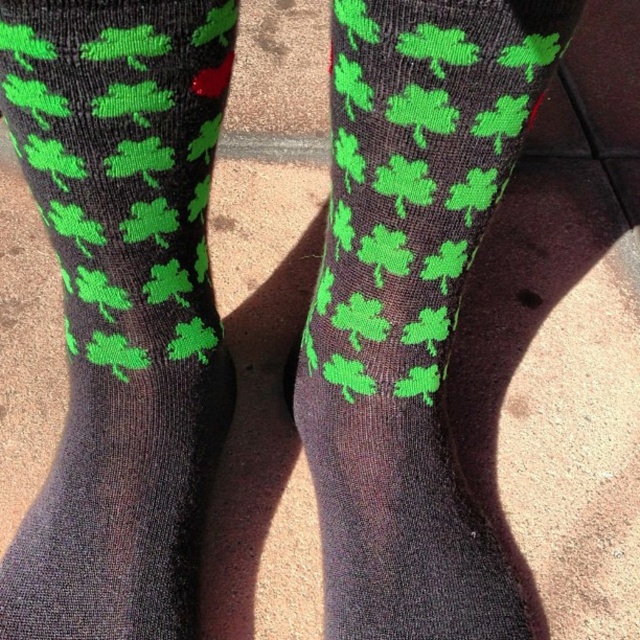
You are standing in a room with a light brown floor and see a pair of feet wearing dark gray or black socks with green clover patterns. There is a point marked at coordinates (122, 305). What object is located at that point?

The point at coordinates (122, 305) marks the location of the matte black socks at left.

You are a fashion designer trying to create a matching pair of socks for a client. The client wants the socks to be the same size as the smaller one between the matte black socks at left and the matte black socks at center. Which sock should you use as your reference?

The matte black socks at center is smaller in size compared to the matte black socks at left, so you should use the matte black socks at center as your reference to create a matching pair of socks with the desired smaller size.